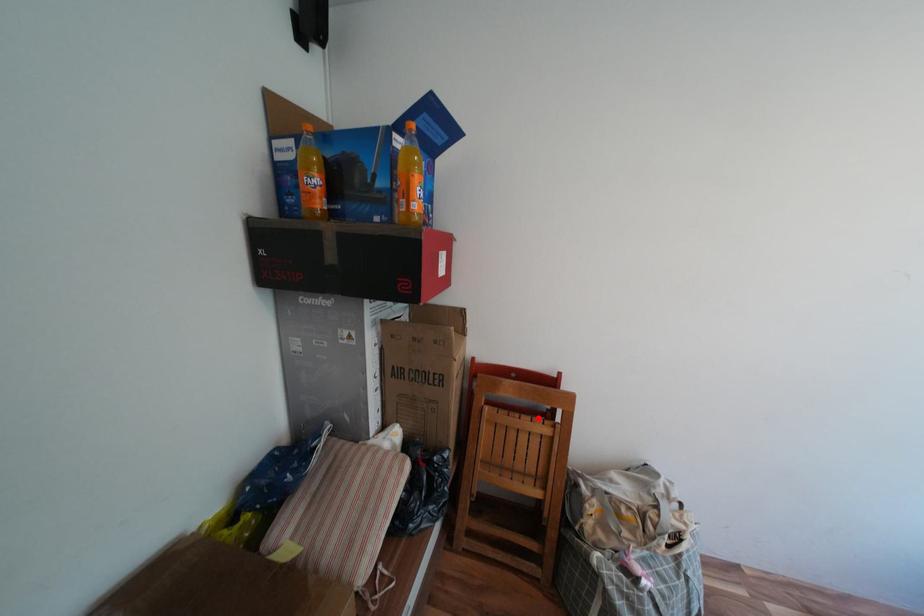
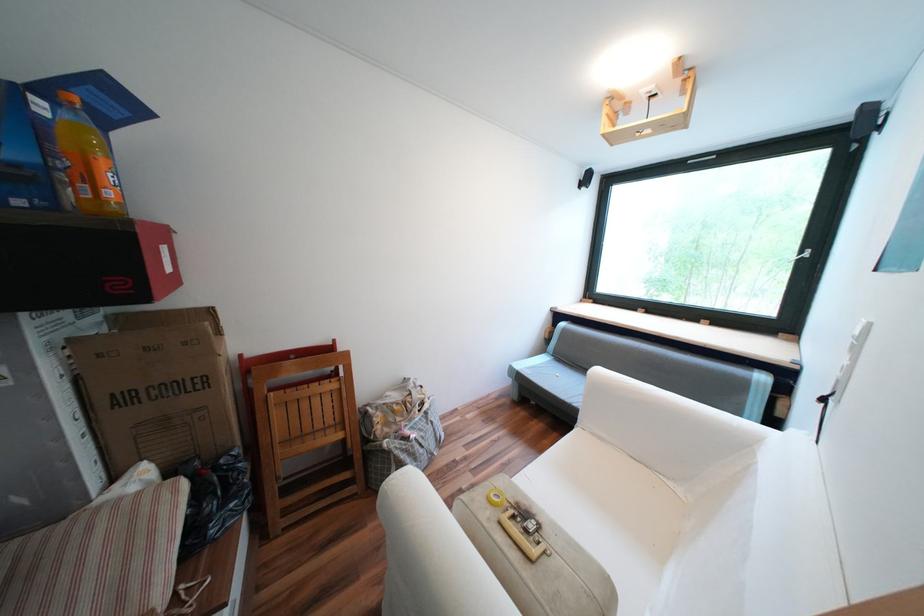
In the second image, find the point that corresponds to the highlighted location in the first image.

(325, 383)